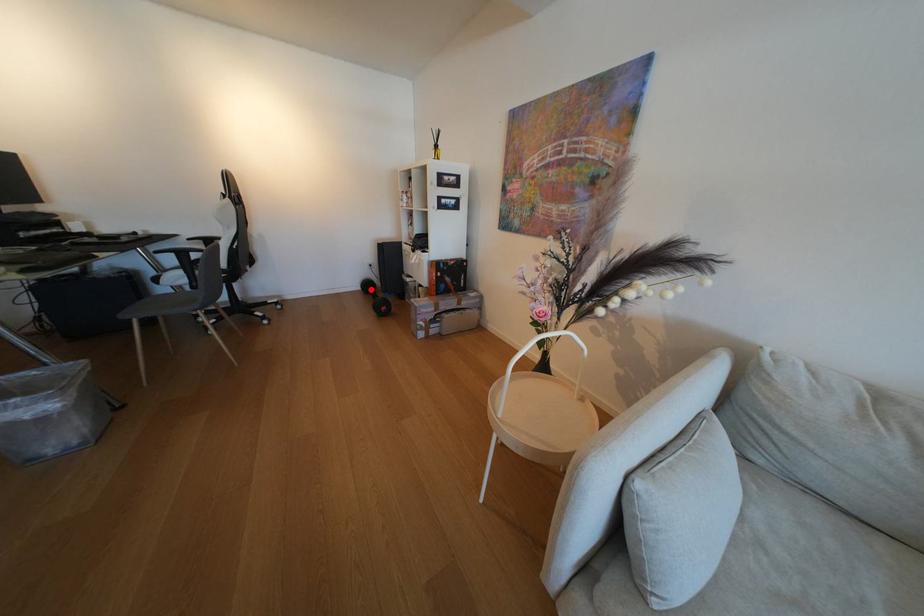
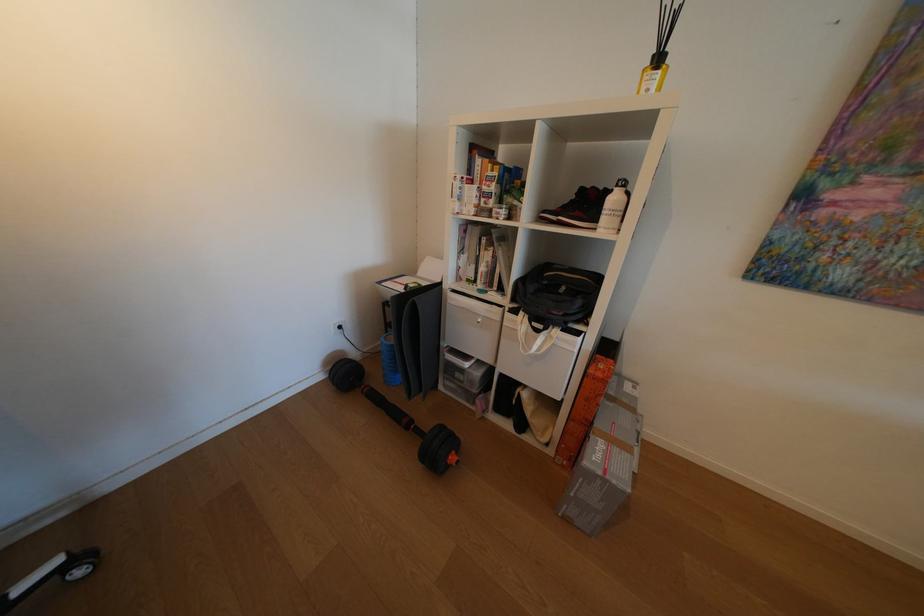
Question: A red point is marked in image1. In image2, is the corresponding 3D point closer to the camera or farther? Reply with the corresponding letter.

Choices:
 (A) The corresponding 3D point is closer.
 (B) The corresponding 3D point is farther.

Answer: (A)